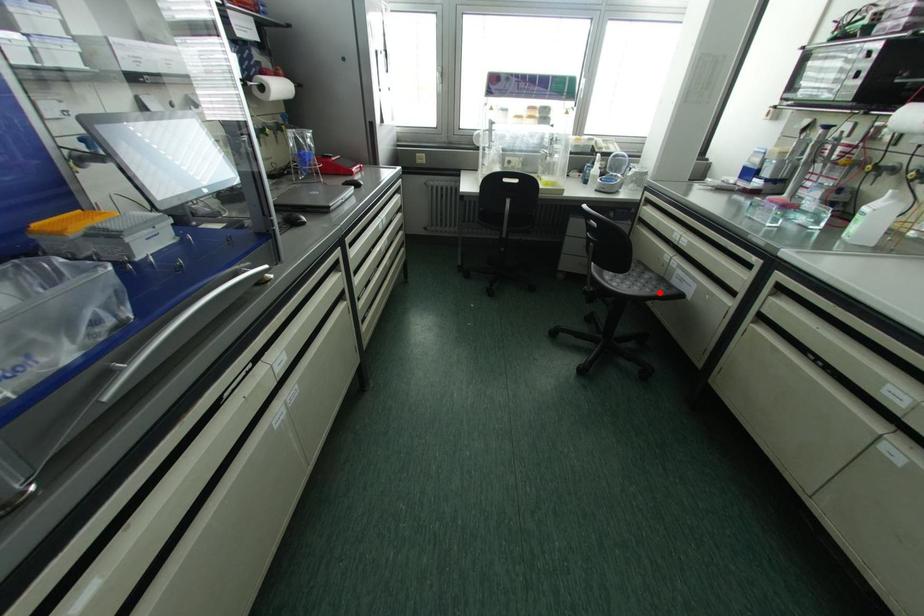
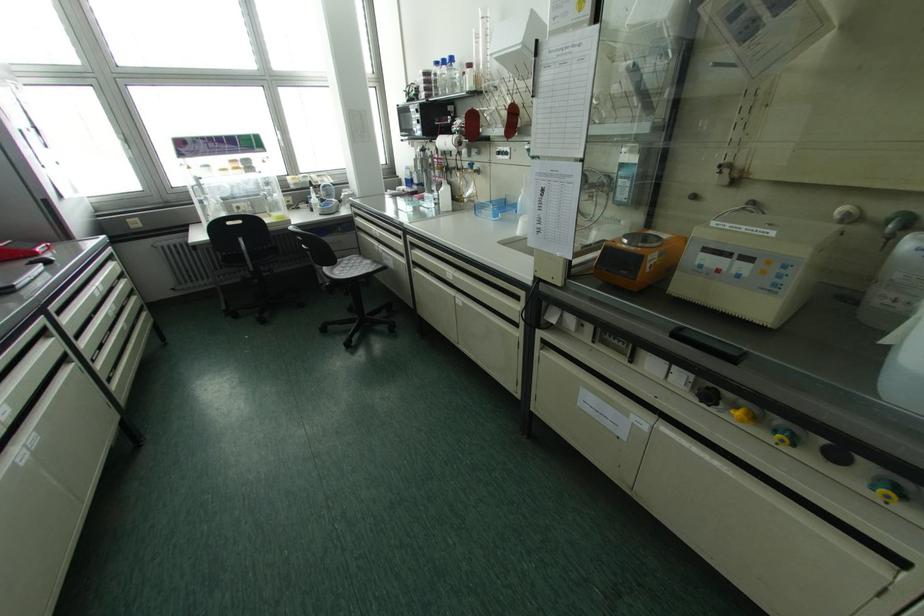
Question: I am providing you with two images of the same scene from different viewpoints. In image1, a red point is highlighted. Considering the same 3D point in image2, which of the following is correct?

Choices:
 (A) It is closer
 (B) It is farther

Answer: (A)